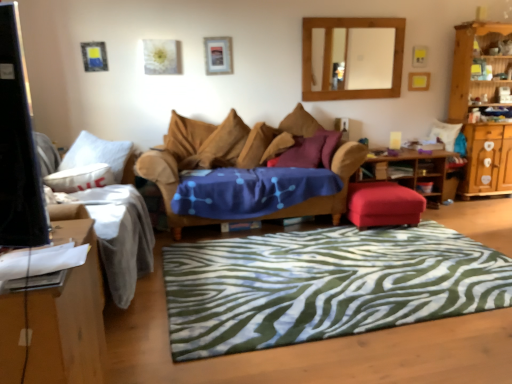
Question: Relative to wooden framed mirror at upper center, is metallic silver picture frame at upper center in front or behind?

Choices:
 (A) behind
 (B) front

Answer: (B)

Question: Looking at the image, does metallic silver picture frame at upper center seem bigger or smaller compared to wooden framed mirror at upper center?

Choices:
 (A) big
 (B) small

Answer: (B)

Question: Based on their relative distances, which object is farther from the brown fabric pillow at center, the 2th pillow positioned from the right?

Choices:
 (A) wooden desk at left
 (B) wooden framed mirror at upper center
 (C) white soft pillow at left, marked as the 4th pillow in a right-to-left arrangement
 (D) green zebra-patterned rug at center
 (E) white fabric couch at left, positioned as the second studio couch in right-to-left order

Answer: (A)

Question: Which is nearer to the white soft pillow at left, marked as the 4th pillow in a right-to-left arrangement?

Choices:
 (A) purple fabric pillow at center, the 4th pillow when ordered from left to right
 (B) wooden desk at left
 (C) brown fabric pillow at center, arranged as the third pillow when viewed from the right
 (D) velvet brown couch at center, which is counted as the 2th studio couch, starting from the left
 (E) green zebra-patterned rug at center

Answer: (D)